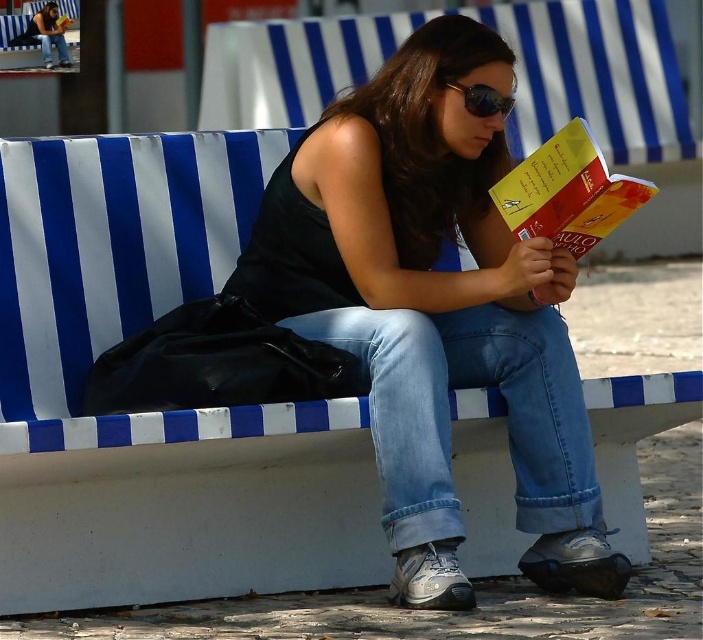
Is matte black tank top at center bigger than yellow paper at center?

Yes.

Looking at this image, who is more distant from viewer, (x=524, y=387) or (x=541, y=228)?

The point (x=524, y=387) is more distant.

Identify the location of matte black tank top at center. The image size is (703, 640). (434, 310).

The height and width of the screenshot is (640, 703). What do you see at coordinates (434, 310) in the screenshot?
I see `matte black tank top at center` at bounding box center [434, 310].

Does matte black tank top at center lie behind sunglasses at center?

No, matte black tank top at center is closer to the viewer.

Is point (283, 317) farther from viewer compared to point (486, 104)?

Yes.

The height and width of the screenshot is (640, 703). I want to click on matte black tank top at center, so click(x=434, y=310).

Consider the image. Does yellow paper at center come in front of sunglasses at center?

That is True.

Is yellow paper at center thinner than sunglasses at center?

In fact, yellow paper at center might be wider than sunglasses at center.

Is point (541, 161) positioned after point (457, 83)?

No.

Where is `yellow paper at center`? yellow paper at center is located at coordinates (567, 193).